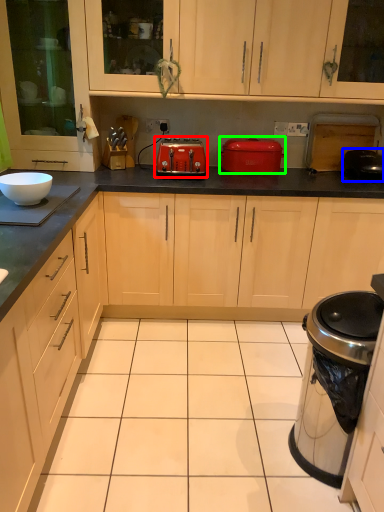
Question: Based on their relative distances, which object is nearer to toaster (highlighted by a red box)? Choose from appliance (highlighted by a blue box) and kitchen appliance (highlighted by a green box).

Choices:
 (A) appliance
 (B) kitchen appliance

Answer: (B)